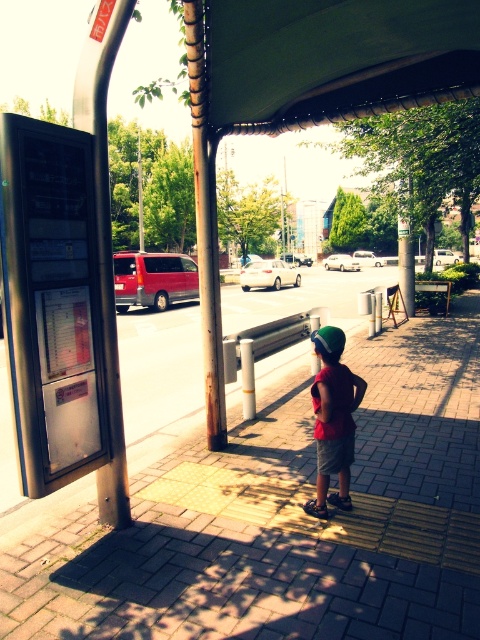
Question: Which point appears farthest from the camera in this image?

Choices:
 (A) (339, 340)
 (B) (391, 60)
 (C) (331, 467)

Answer: (B)

Question: Can you confirm if brick pavement at center is bigger than green matte baseball hat at center?

Choices:
 (A) no
 (B) yes

Answer: (A)

Question: Which point is closer to the camera?

Choices:
 (A) green fabric canopy at upper center
 (B) green matte baseball hat at center
 (C) matte red shirt at center

Answer: (A)

Question: Which is farther from the brick pavement at center?

Choices:
 (A) matte red shirt at center
 (B) green matte baseball hat at center

Answer: (B)

Question: Does green fabric canopy at upper center appear over matte red shirt at center?

Choices:
 (A) yes
 (B) no

Answer: (A)

Question: Is green fabric canopy at upper center above matte red shirt at center?

Choices:
 (A) yes
 (B) no

Answer: (A)